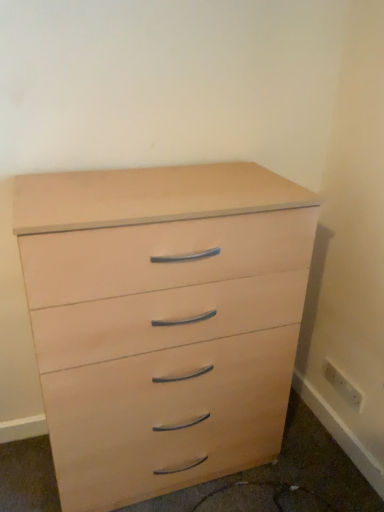
Question: From the image's perspective, is white plastic electric outlet at lower right located above or below light wood drawer at lower right?

Choices:
 (A) below
 (B) above

Answer: (B)

Question: In terms of size, does white plastic electric outlet at lower right appear bigger or smaller than light wood drawer at lower right?

Choices:
 (A) small
 (B) big

Answer: (A)

Question: Estimate the real-world distances between objects in this image. Which object is farther from the light wood/veneer chest of drawers at center?

Choices:
 (A) light wood drawer at lower right
 (B) white plastic electric outlet at lower right

Answer: (B)

Question: Which is nearer to the light wood drawer at lower right?

Choices:
 (A) white plastic electric outlet at lower right
 (B) light wood/veneer chest of drawers at center

Answer: (B)